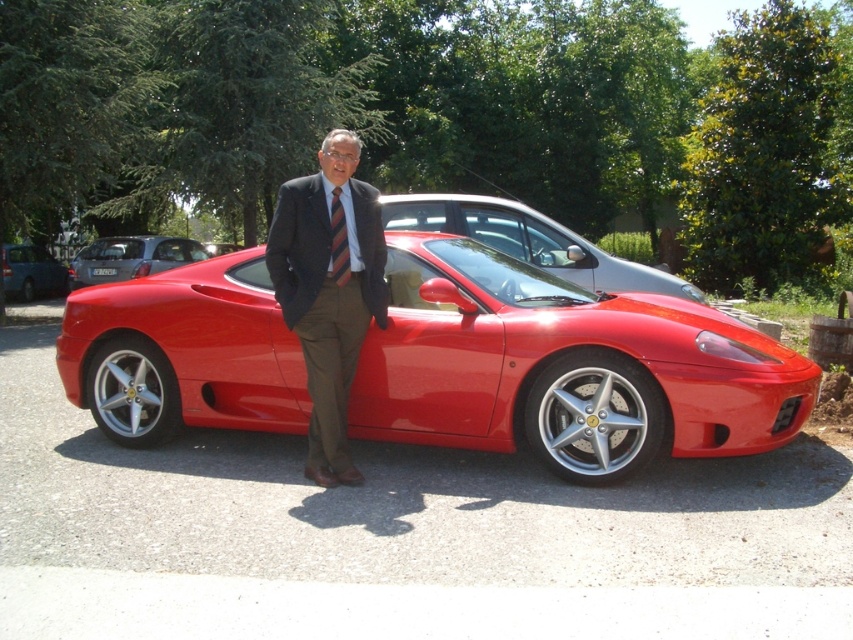
You are a delivery driver who needs to park your vehicle in a tight space. You see the glossy metallic hatchback at center and the matte blue van at left. Which vehicle should you choose to fit better in the space?

The glossy metallic hatchback at center is smaller than the matte blue van at left, so it would fit better in the tight space.

You are standing in front of the image and see the point at coordinates (717,324). If you want to touch that point with a 2.59 meter long stick, can you reach it?

The point at coordinates (717,324) is 5.18 meters away from the viewer. Since the stick is only 2.59 meters long, you cannot reach the point with it.

You are a photographer trying to capture the man and the Ferrari in the scene. You notice two points marked in the image. Which point is closer to your camera lens, point at coordinate (733, 449) or point at coordinate (337, 205)?

Point at coordinate (337, 205) is closer to the camera lens because the Objects Description states that point (733, 449) is further away than point (337, 205).